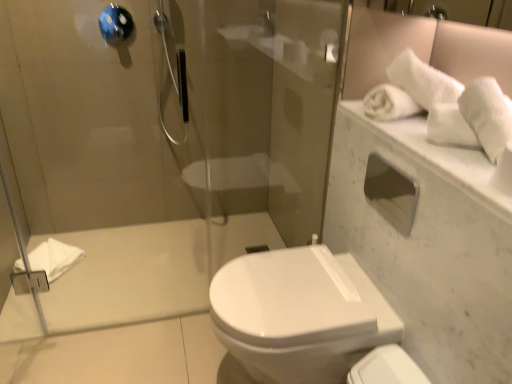
Image resolution: width=512 pixels, height=384 pixels. Describe the element at coordinates (386, 368) in the screenshot. I see `white glossy toilet at lower right` at that location.

Describe the element at coordinates (487, 114) in the screenshot. I see `white soft towel at upper right, arranged as the second bath towel when ordered from the bottom` at that location.

Locate an element on the screen. matte silver showerhead at upper center is located at coordinates (173, 74).

What do you see at coordinates (116, 24) in the screenshot?
I see `blue glossy towel bar at upper left` at bounding box center [116, 24].

Measure the distance between point (124, 15) and camera.

1.93 meters.

Describe the element at coordinates (54, 258) in the screenshot. I see `white matte towel at left, the 2th bath towel in the right-to-left sequence` at that location.

Locate an element on the screen. The image size is (512, 384). white glossy bidet at center is located at coordinates (298, 314).

Where is `white glossy toilet at lower right`? The image size is (512, 384). white glossy toilet at lower right is located at coordinates (386, 368).

From the image's perspective, which is below, white glossy toilet at lower right or white glossy bidet at center?

white glossy toilet at lower right is shown below in the image.

Which is more to the left, white glossy toilet at lower right or white glossy bidet at center?

From the viewer's perspective, white glossy bidet at center appears more on the left side.

Are white glossy toilet at lower right and white glossy bidet at center beside each other?

No, white glossy toilet at lower right is not with white glossy bidet at center.

Is white glossy toilet at lower right oriented towards white glossy bidet at center?

No, white glossy toilet at lower right is not turned towards white glossy bidet at center.

Locate an element on the screen. mirror below the white soft towel at upper right, arranged as the 1th bath towel when viewed from the front (from the image's perspective) is located at coordinates (423, 49).

Between white soft towel at upper right, which is the 1th bath towel in top-to-bottom order, and white marble mirror at upper right, which one has larger size?

With larger size is white marble mirror at upper right.

Which object is positioned more to the right, white soft towel at upper right, the 1th bath towel when ordered from right to left, or white marble mirror at upper right?

white soft towel at upper right, the 1th bath towel when ordered from right to left, is more to the right.

Is white soft towel at upper right, which is the 1th bath towel in top-to-bottom order, spatially inside white marble mirror at upper right, or outside of it?

white soft towel at upper right, which is the 1th bath towel in top-to-bottom order, cannot be found inside white marble mirror at upper right.

Looking at their sizes, would you say white glossy toilet at lower right is wider or thinner than white soft towel at upper right, which is the 1th bath towel in top-to-bottom order?

Clearly, white glossy toilet at lower right has more width compared to white soft towel at upper right, which is the 1th bath towel in top-to-bottom order.

Is white glossy toilet at lower right at the left side of white soft towel at upper right, which is the 1th bath towel in top-to-bottom order?

Indeed, white glossy toilet at lower right is positioned on the left side of white soft towel at upper right, which is the 1th bath towel in top-to-bottom order.

How far apart are white glossy toilet at lower right and white soft towel at upper right, arranged as the 1th bath towel when viewed from the front?

A distance of 24.95 inches exists between white glossy toilet at lower right and white soft towel at upper right, arranged as the 1th bath towel when viewed from the front.

From a real-world perspective, between white glossy toilet at lower right and white soft towel at upper right, which ranks as the second bath towel in left-to-right order, who is vertically lower?

In real-world perspective, white glossy toilet at lower right is lower.

Considering the relative sizes of white glossy toilet at lower right and matte silver showerhead at upper center in the image provided, is white glossy toilet at lower right taller than matte silver showerhead at upper center?

No.

Is white glossy toilet at lower right with matte silver showerhead at upper center?

There is a gap between white glossy toilet at lower right and matte silver showerhead at upper center.

Does point (403, 364) appear closer or farther from the camera than point (157, 11)?

Point (403, 364) is closer to the camera than point (157, 11).

How different are the orientations of white matte towel at left, which appears as the 1th bath towel when viewed from the left, and white soft towel at upper right, which ranks as the second bath towel in left-to-right order, in degrees?

The angle between the facing direction of white matte towel at left, which appears as the 1th bath towel when viewed from the left, and the facing direction of white soft towel at upper right, which ranks as the second bath towel in left-to-right order, is 147 degrees.

Where is `bath towel on the right of white matte towel at left, marked as the 2th bath towel in a front-to-back arrangement`? bath towel on the right of white matte towel at left, marked as the 2th bath towel in a front-to-back arrangement is located at coordinates (487, 114).

Considering the points (69, 259) and (484, 103), which point is in front, point (69, 259) or point (484, 103)?

Point (484, 103)

Could white soft towel at upper right, arranged as the second bath towel when ordered from the bottom, be considered to be inside white matte towel at left, marked as the first bath towel in a bottom-to-top arrangement?

That's incorrect, white soft towel at upper right, arranged as the second bath towel when ordered from the bottom, is not inside white matte towel at left, marked as the first bath towel in a bottom-to-top arrangement.

Could you measure the distance between matte silver showerhead at upper center and white soft towel at upper right, the 2th bath towel viewed from the back?

They are 4.80 feet apart.

In the scene shown: Would you say matte silver showerhead at upper center is inside or outside white soft towel at upper right, which is the 1th bath towel in top-to-bottom order?

matte silver showerhead at upper center is outside white soft towel at upper right, which is the 1th bath towel in top-to-bottom order.

Is matte silver showerhead at upper center positioned behind white soft towel at upper right, the 1th bath towel when ordered from right to left?

Yes, it is behind white soft towel at upper right, the 1th bath towel when ordered from right to left.

From the picture: From a real-world perspective, who is located higher, white matte towel at left, marked as the 2th bath towel in a front-to-back arrangement, or white glossy bidet at center?

white glossy bidet at center.

Does white matte towel at left, which appears as the 1th bath towel when viewed from the left, have a greater height compared to white glossy bidet at center?

Incorrect, the height of white matte towel at left, which appears as the 1th bath towel when viewed from the left, is not larger of that of white glossy bidet at center.

Locate an element on the screen. toilet located on the right of white glossy bidet at center is located at coordinates (386, 368).

Locate an element on the screen. The height and width of the screenshot is (384, 512). mirror below the white soft towel at upper right, which ranks as the second bath towel in left-to-right order (from the image's perspective) is located at coordinates (423, 49).

Consider the image. From the image, which object appears to be farther from white glossy bidet at center, white glossy toilet at lower right or white marble mirror at upper right?

Based on the image, white marble mirror at upper right appears to be further to white glossy bidet at center.

Estimate the real-world distances between objects in this image. Which object is closer to matte silver showerhead at upper center, white glossy bidet at center or white matte towel at left, marked as the 2th bath towel in a front-to-back arrangement?

white matte towel at left, marked as the 2th bath towel in a front-to-back arrangement, is positioned closer to the anchor matte silver showerhead at upper center.

When comparing their distances from white glossy toilet at lower right, does white marble mirror at upper right or white matte towel at left, positioned as the 1th bath towel in back-to-front order, seem further?

Result: white matte towel at left, positioned as the 1th bath towel in back-to-front order, is further to white glossy toilet at lower right.

Considering their positions, is white glossy toilet at lower right positioned further to white marble mirror at upper right than white soft towel at upper right, the 2th bath towel viewed from the back?

The object further to white marble mirror at upper right is white glossy toilet at lower right.

When comparing their distances from white glossy bidet at center, does matte silver showerhead at upper center or white marble mirror at upper right seem further?

Based on the image, matte silver showerhead at upper center appears to be further to white glossy bidet at center.

From the image, which object appears to be nearer to white marble mirror at upper right, blue glossy towel bar at upper left or white matte towel at left, positioned as the 1th bath towel in back-to-front order?

blue glossy towel bar at upper left lies closer to white marble mirror at upper right than the other object.

Looking at the image, which one is located closer to blue glossy towel bar at upper left, white glossy bidet at center or white soft towel at upper right, the 1th bath towel when ordered from right to left?

Based on the image, white glossy bidet at center appears to be nearer to blue glossy towel bar at upper left.

Estimate the real-world distances between objects in this image. Which object is closer to white matte towel at left, the 2th bath towel in the right-to-left sequence, white glossy toilet at lower right or white glossy bidet at center?

white glossy bidet at center is positioned closer to the anchor white matte towel at left, the 2th bath towel in the right-to-left sequence.

Locate an element on the screen. This screenshot has height=384, width=512. bidet between white matte towel at left, which appears as the 1th bath towel when viewed from the left, and white glossy toilet at lower right, in the horizontal direction is located at coordinates (298, 314).

The width and height of the screenshot is (512, 384). In order to click on bidet between white marble mirror at upper right and matte silver showerhead at upper center along the z-axis in this screenshot , I will do `click(298, 314)`.

Locate an element on the screen. Image resolution: width=512 pixels, height=384 pixels. shower between white matte towel at left, which appears as the 1th bath towel when viewed from the left, and white soft towel at upper right, the 1th bath towel when ordered from right to left is located at coordinates (173, 74).

Locate an element on the screen. shower between white matte towel at left, marked as the first bath towel in a bottom-to-top arrangement, and white marble mirror at upper right, in the horizontal direction is located at coordinates coord(173,74).